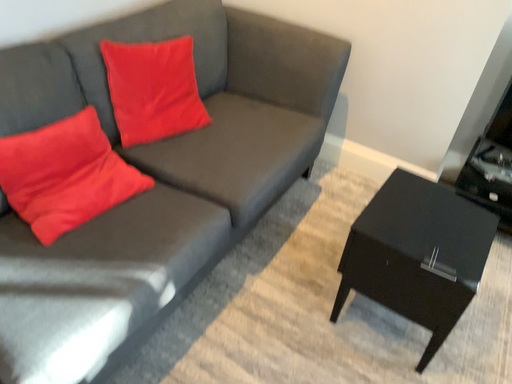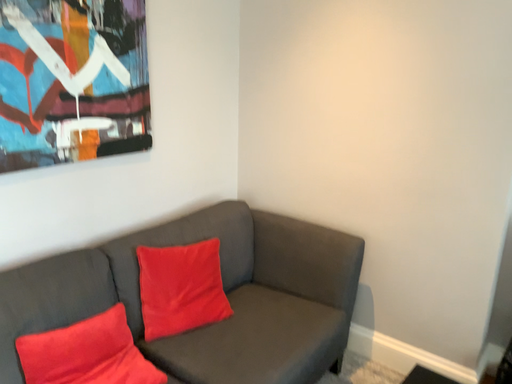
Question: How did the camera likely rotate when shooting the video?

Choices:
 (A) rotated upward
 (B) rotated downward

Answer: (A)